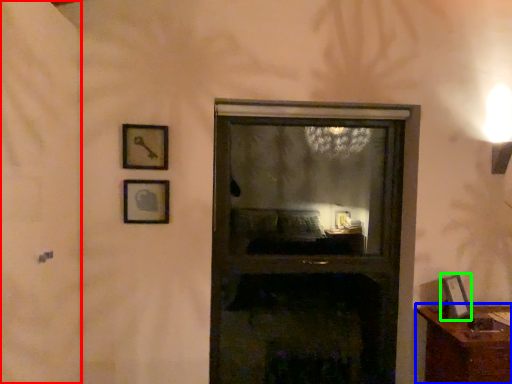
Question: Which object is positioned closest to screen door (highlighted by a red box)? Select from furniture (highlighted by a blue box) and picture frame (highlighted by a green box).

Choices:
 (A) furniture
 (B) picture frame

Answer: (A)